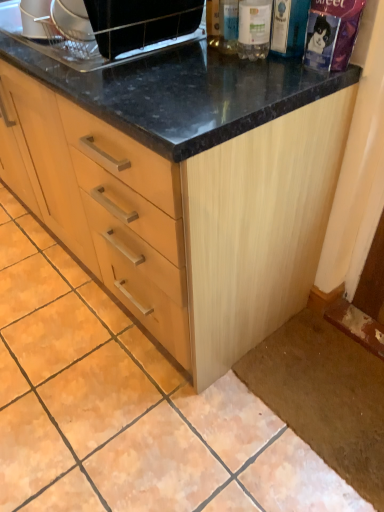
Question: In terms of height, does black glossy microwave at upper center look taller or shorter compared to clear glass bottle at upper center, the 1th bottle from the left?

Choices:
 (A) short
 (B) tall

Answer: (B)

Question: Is black glossy microwave at upper center bigger or smaller than clear glass bottle at upper center, arranged as the 3th bottle when viewed from the right?

Choices:
 (A) big
 (B) small

Answer: (A)

Question: Which object is the closest to the light wood cabinet at center?

Choices:
 (A) black glossy microwave at upper center
 (B) clear plastic bottle at upper right, the second bottle when ordered from left to right
 (C) transparent plastic bottle at upper right, acting as the third bottle starting from the left
 (D) clear glass bottle at upper center, the 1th bottle from the left

Answer: (A)

Question: Considering the real-world distances, which object is closest to the light wood cabinet at center?

Choices:
 (A) black glossy microwave at upper center
 (B) clear plastic bottle at upper right, the second bottle when ordered from left to right
 (C) clear glass bottle at upper center, arranged as the 3th bottle when viewed from the right
 (D) transparent plastic bottle at upper right, acting as the third bottle starting from the left

Answer: (A)